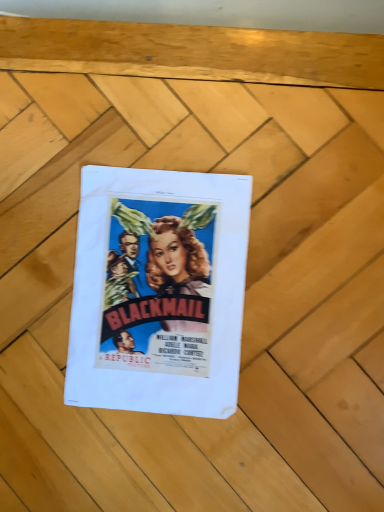
What is the approximate width of matte paper poster at center?

matte paper poster at center is 30.48 centimeters in width.

Describe the element at coordinates (158, 291) in the screenshot. This screenshot has width=384, height=512. I see `matte paper poster at center` at that location.

The height and width of the screenshot is (512, 384). I want to click on matte paper poster at center, so click(158, 291).

Locate an element on the screen. Image resolution: width=384 pixels, height=512 pixels. matte paper poster at center is located at coordinates (158, 291).